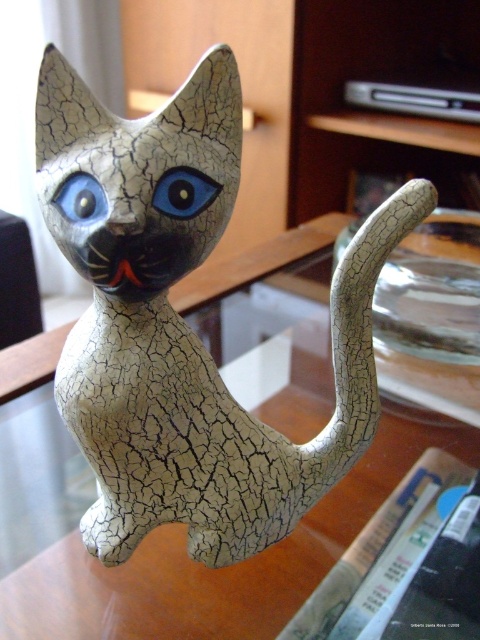
Does point (149, 438) come behind point (92, 179)?

Yes, it is behind point (92, 179).

Is cracked ceramic cat at center bigger than blue glossy eye at left?

Yes, cracked ceramic cat at center is bigger than blue glossy eye at left.

The height and width of the screenshot is (640, 480). I want to click on cracked ceramic cat at center, so [188, 326].

Which is more to the right, cracked ceramic cat at center or blue glossy eye at center?

From the viewer's perspective, cracked ceramic cat at center appears more on the right side.

Can you confirm if cracked ceramic cat at center is positioned to the right of blue glossy eye at center?

Correct, you'll find cracked ceramic cat at center to the right of blue glossy eye at center.

Find the location of a particular element. cracked ceramic cat at center is located at coordinates coord(188,326).

Find the location of a particular element. This screenshot has width=480, height=640. cracked ceramic cat at center is located at coordinates (188, 326).

Which of these two, blue glossy eye at center or blue glossy eye at left, stands taller?

With more height is blue glossy eye at left.

Can you confirm if blue glossy eye at center is positioned to the left of blue glossy eye at left?

In fact, blue glossy eye at center is to the right of blue glossy eye at left.

The width and height of the screenshot is (480, 640). Identify the location of blue glossy eye at center. (183, 193).

Locate an element on the screen. blue glossy eye at center is located at coordinates (183, 193).